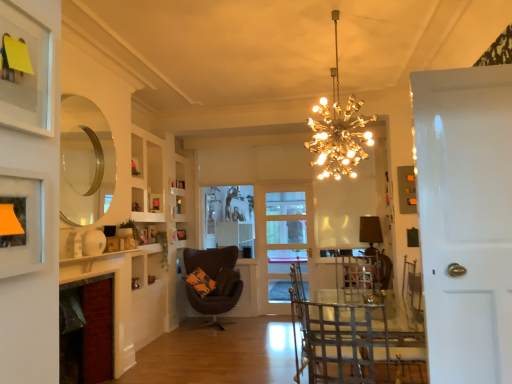
I want to click on free location above gold metallic chandelier at upper center (from a real-world perspective), so click(331, 20).